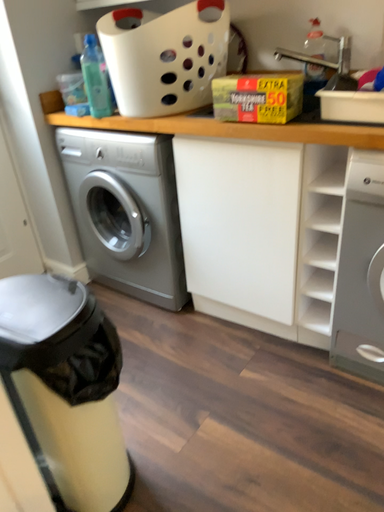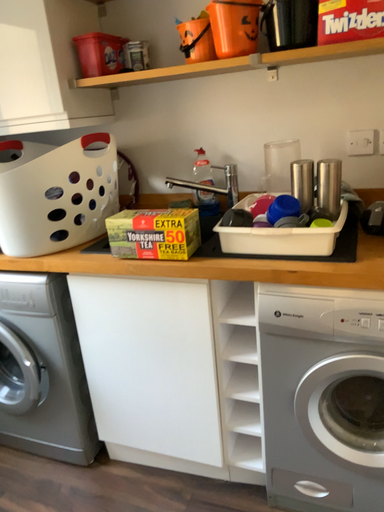
Question: Which way did the camera rotate in the video?

Choices:
 (A) rotated upward
 (B) rotated downward

Answer: (A)